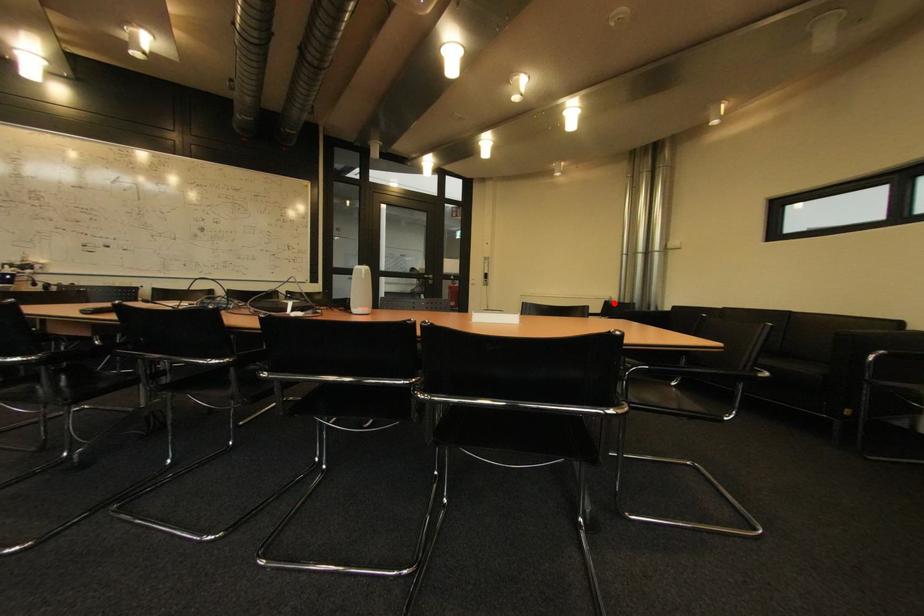
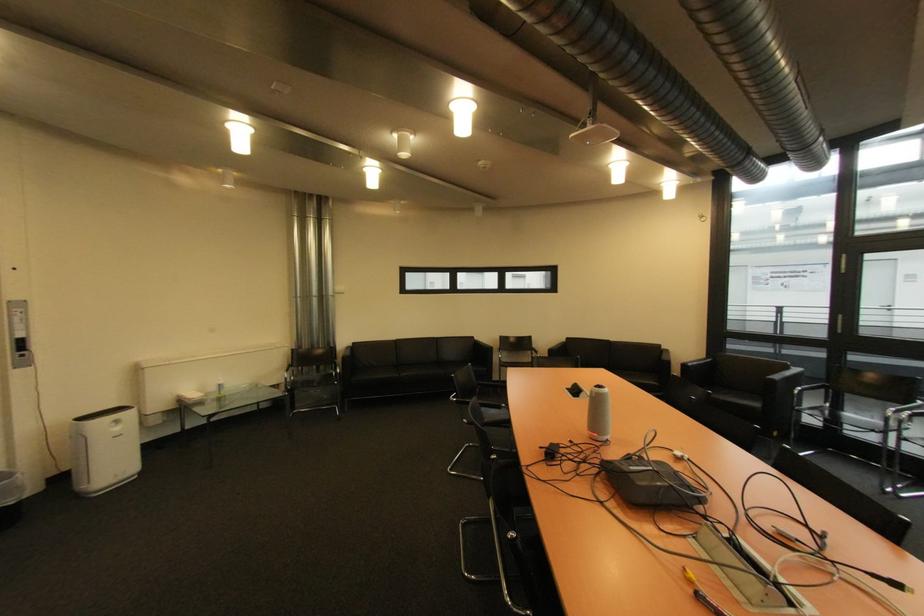
Locate, in the second image, the point that corresponds to the highlighted location in the first image.

(301, 352)